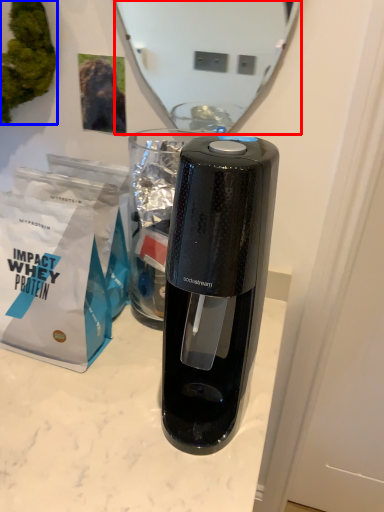
Question: Which object appears farthest to the camera in this image, mirror (highlighted by a red box) or plant (highlighted by a blue box)?

Choices:
 (A) mirror
 (B) plant

Answer: (B)